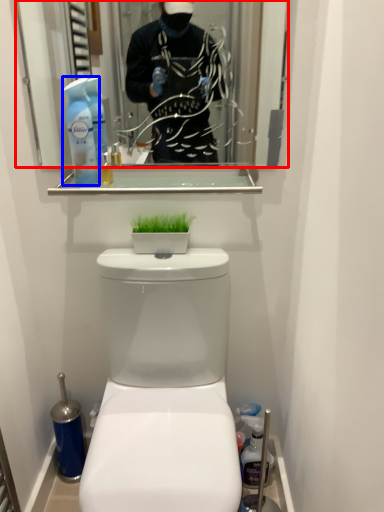
Question: Which object is closer to the camera taking this photo, mirror (highlighted by a red box) or cleaning product (highlighted by a blue box)?

Choices:
 (A) mirror
 (B) cleaning product

Answer: (B)